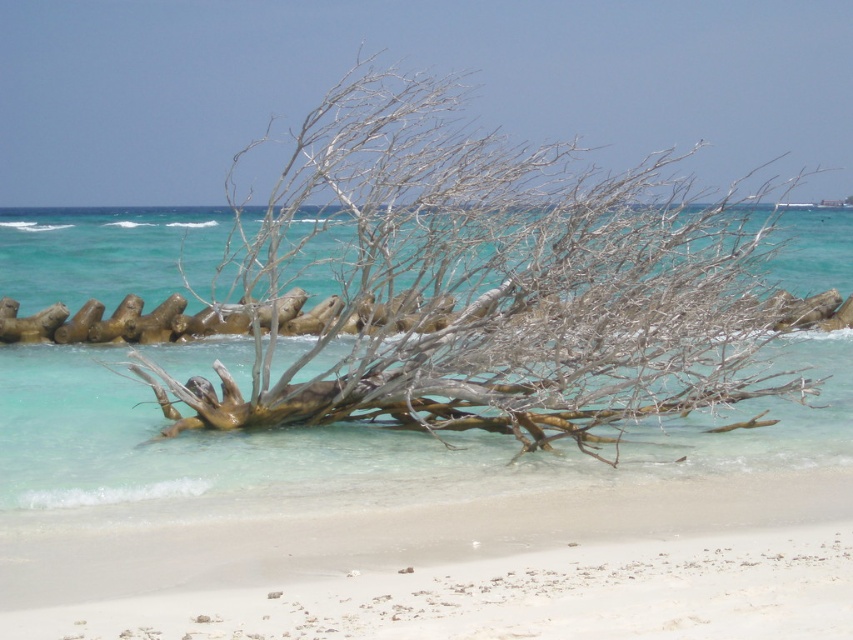
Is gray wood tree at center further to the viewer compared to white sandy beach at lower center?

That is True.

The width and height of the screenshot is (853, 640). What are the coordinates of `gray wood tree at center` in the screenshot? It's located at [x=485, y=284].

At what (x,y) coordinates should I click in order to perform the action: click on gray wood tree at center. Please return your answer as a coordinate pair (x, y). Looking at the image, I should click on (485, 284).